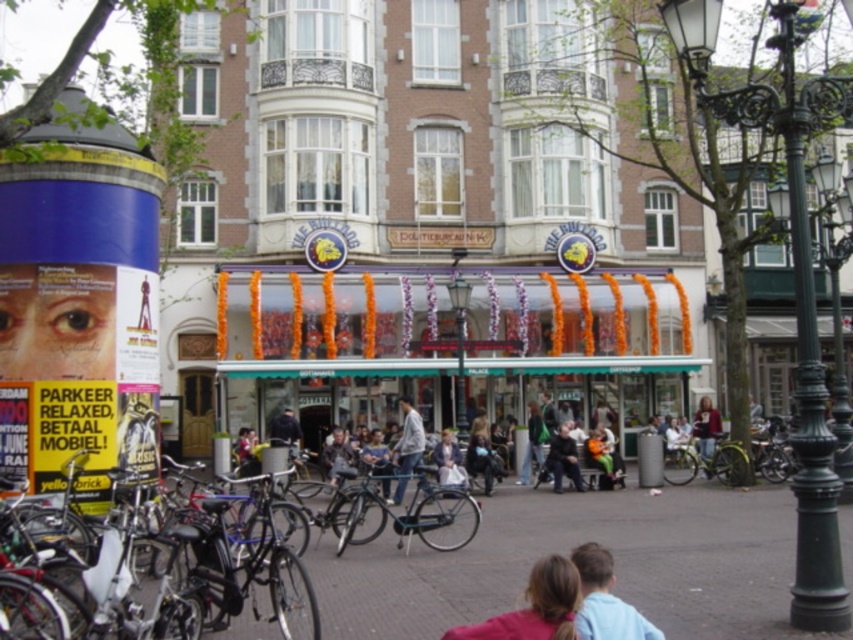
You are a delivery person who needs to place a large package on the ground between the silver metallic bicycle at lower left and the light brown leather jacket at center. Is there enough space to place the package between them?

The silver metallic bicycle at lower left is positioned on the left side of light brown leather jacket at center, so there is space between them to place the package.

You are a delivery person trying to place a large package on the ground in front of the building. The package is the size of the dark brown leather jacket at center. Will there be enough space on the concrete pavement at center to place it without overlapping anything?

The concrete pavement at center has a larger size compared to the dark brown leather jacket at center. Therefore, there is enough space on the concrete pavement at center to place the package without overlapping anything.

You are a delivery person standing at the entrance of the building and need to place a package on the ground. You see the concrete pavement at center and the dark brown leather jacket at center. Which object should you place the package on?

The concrete pavement at center is in front of the dark brown leather jacket at center, so you should place the package on the concrete pavement at center since it is closer to you.